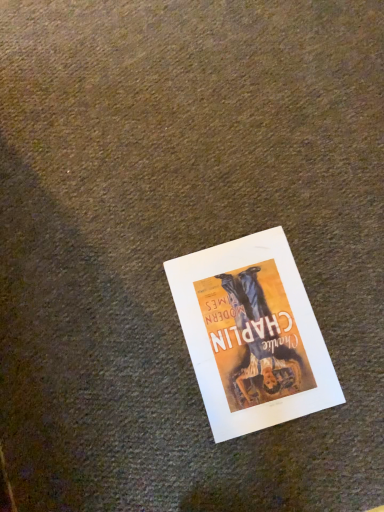
Where is `blank area to the left of white paper poster at center`? blank area to the left of white paper poster at center is located at coordinates (123, 367).